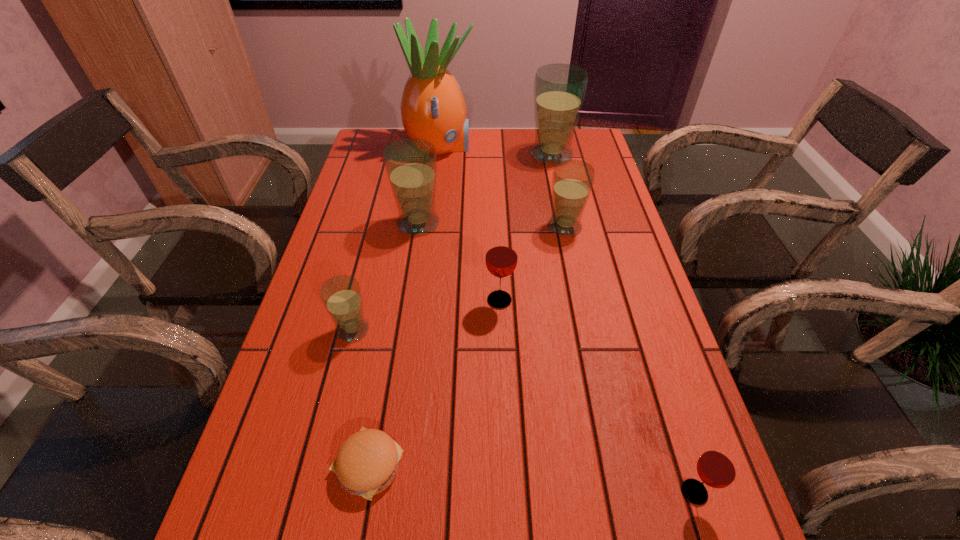
Locate an element on the screen. the nearest blue glass is located at coordinates (341, 295).

Locate an element on the screen. The height and width of the screenshot is (540, 960). the smaller red glass is located at coordinates (718, 467).

Locate an element on the screen. This screenshot has width=960, height=540. the rightmost glass is located at coordinates (718, 467).

Find the location of a particular element. The image size is (960, 540). the shortest object is located at coordinates (367, 462).

This screenshot has height=540, width=960. I want to click on free space located 0.210m at the entrance of the orange pineapple, so click(x=536, y=147).

Locate an element on the screen. The width and height of the screenshot is (960, 540). vacant region located on the front of the tallest glass is located at coordinates (567, 228).

Image resolution: width=960 pixels, height=540 pixels. Find the location of `free location located on the right of the fifth shortest glass`. free location located on the right of the fifth shortest glass is located at coordinates (489, 223).

This screenshot has width=960, height=540. Find the location of `free space located 0.140m on the back of the second smallest blue glass`. free space located 0.140m on the back of the second smallest blue glass is located at coordinates (557, 186).

Locate an element on the screen. Image resolution: width=960 pixels, height=540 pixels. free point located 0.340m on the back of the fifth farthest object is located at coordinates coord(495,204).

The height and width of the screenshot is (540, 960). In order to click on free space located 0.330m on the front of the smallest blue glass in this screenshot , I will do `click(307, 513)`.